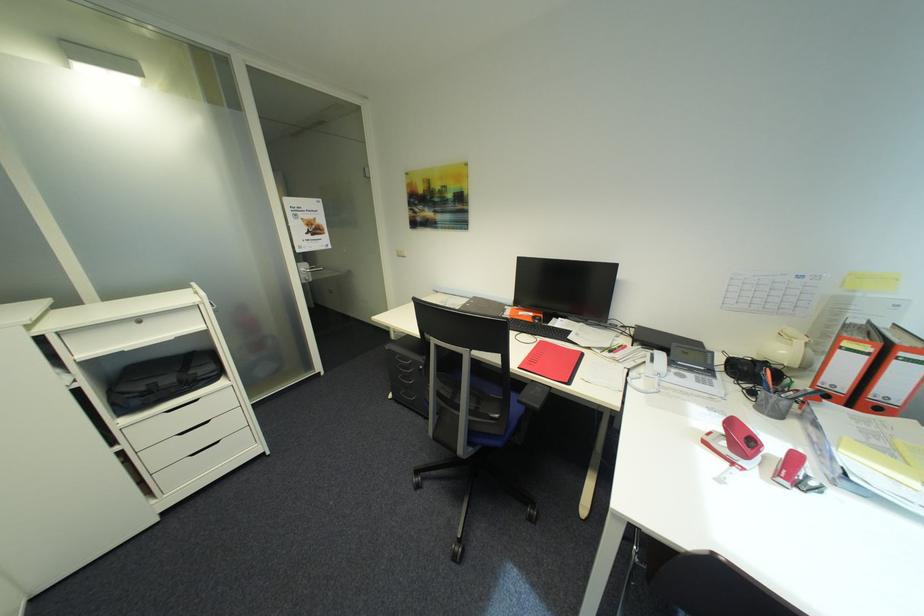
The location [735,444] corresponds to which object?

This point indicates the red stapler.